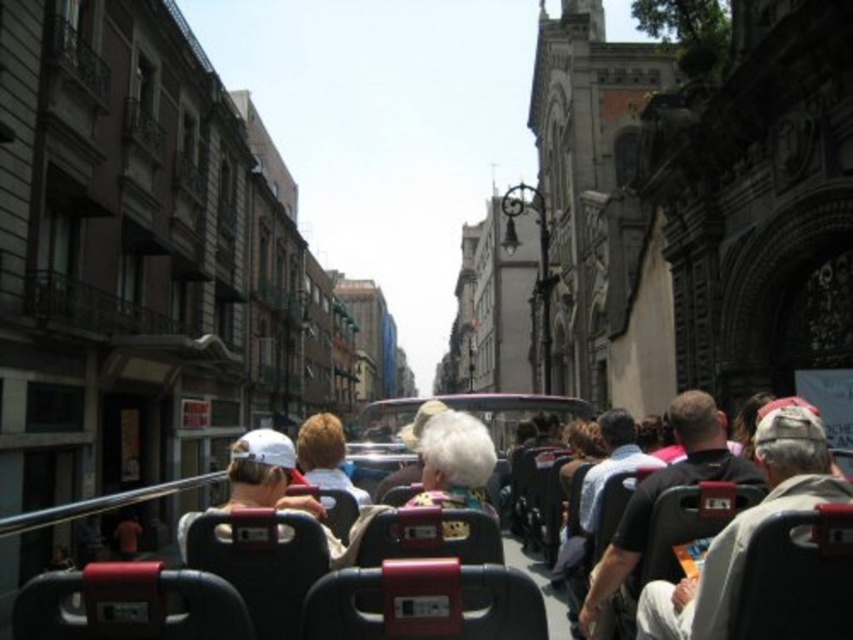
Question: Which object appears farthest from the camera in this image?

Choices:
 (A) black leather coach at center
 (B) white fabric at center

Answer: (A)

Question: Does white fabric at center have a greater width compared to black leather coach at center?

Choices:
 (A) no
 (B) yes

Answer: (A)

Question: Among these points, which one is farthest from the camera?

Choices:
 (A) (717, 561)
 (B) (602, 582)

Answer: (B)

Question: Can you confirm if white fabric at center is bigger than black leather coach at center?

Choices:
 (A) yes
 (B) no

Answer: (B)

Question: Does white fabric at center have a smaller size compared to black leather coach at center?

Choices:
 (A) yes
 (B) no

Answer: (A)